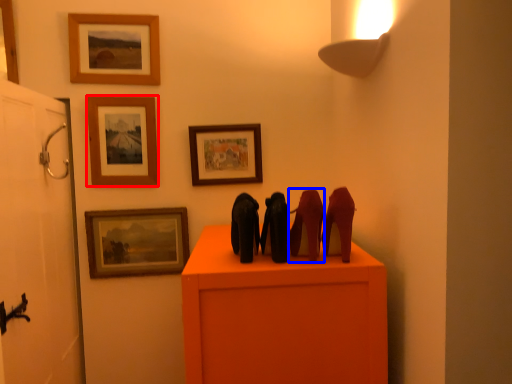
Question: Which object is closer to the camera taking this photo, picture frame (highlighted by a red box) or animal (highlighted by a blue box)?

Choices:
 (A) picture frame
 (B) animal

Answer: (B)